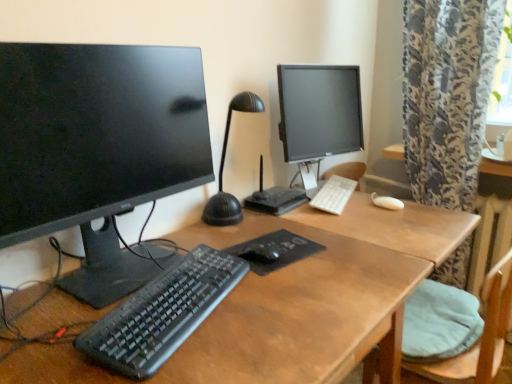
Identify the location of vacant space to the left of black plastic keyboard at center, placed as the second computer keyboard when sorted from top to bottom. The image size is (512, 384). (59, 308).